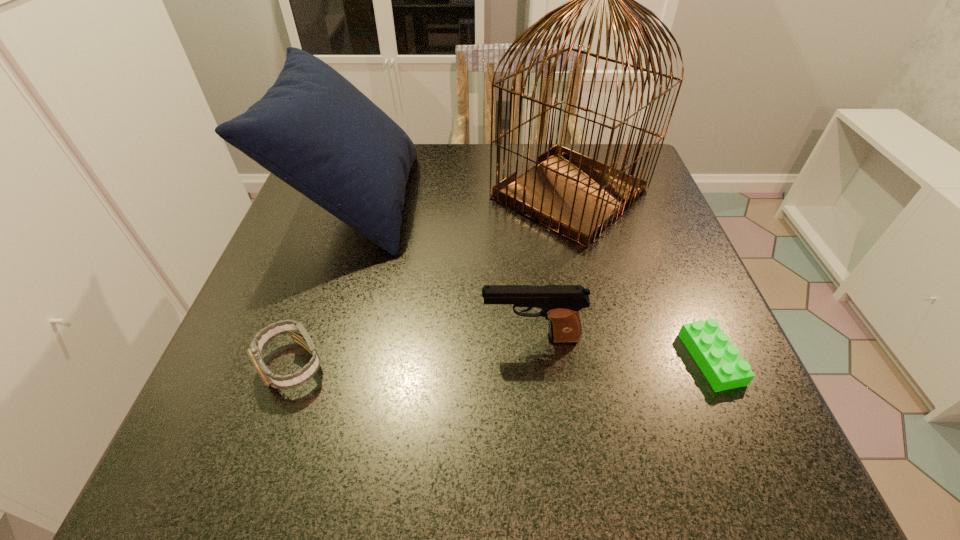
At what (x,y) coordinates should I click in order to perform the action: click on vacant space that is in between the shortest object and the birdcage. Please return your answer as a coordinate pair (x, y). This screenshot has width=960, height=540. Looking at the image, I should click on (640, 277).

You are a GUI agent. You are given a task and a screenshot of the screen. Output one action in this format:
    pyautogui.click(x=<x>, y=<y>)
    Task: Click on the free space between the tallest object and the Lego
    This screenshot has width=960, height=540.
    Given the screenshot: What is the action you would take?
    pyautogui.click(x=640, y=277)

At what (x,y) coordinates should I click in order to perform the action: click on free space between the second shortest object and the tallest object. Please return your answer as a coordinate pair (x, y). The image size is (960, 540). Looking at the image, I should click on (430, 280).

At what (x,y) coordinates should I click in order to perform the action: click on vacant area that lies between the fourth shortest object and the second shortest object. Please return your answer as a coordinate pair (x, y). The image size is (960, 540). Looking at the image, I should click on (324, 283).

The height and width of the screenshot is (540, 960). I want to click on vacant space in between the watch and the shortest object, so click(x=501, y=362).

Select which object is the third closest to the second tallest object. Please provide its 2D coordinates. Your answer should be formatted as a tuple, i.e. [(x, y)], where the tuple contains the x and y coordinates of a point satisfying the conditions above.

[(560, 304)]

What are the coordinates of `object that is the nearest to the cushion` in the screenshot? It's located at (576, 196).

I want to click on vacant space that satisfies the following two spatial constraints: 1. at the barrel of the pistol; 2. on the face of the fourth tallest object, so click(533, 365).

Locate an element on the screen. The image size is (960, 540). free space that satisfies the following two spatial constraints: 1. at the barrel of the third shortest object; 2. on the face of the fourth tallest object is located at coordinates (533, 365).

Identify the location of free location that satisfies the following two spatial constraints: 1. on the facing side of the second tallest object; 2. on the right side of the shortest object. Image resolution: width=960 pixels, height=540 pixels. (302, 359).